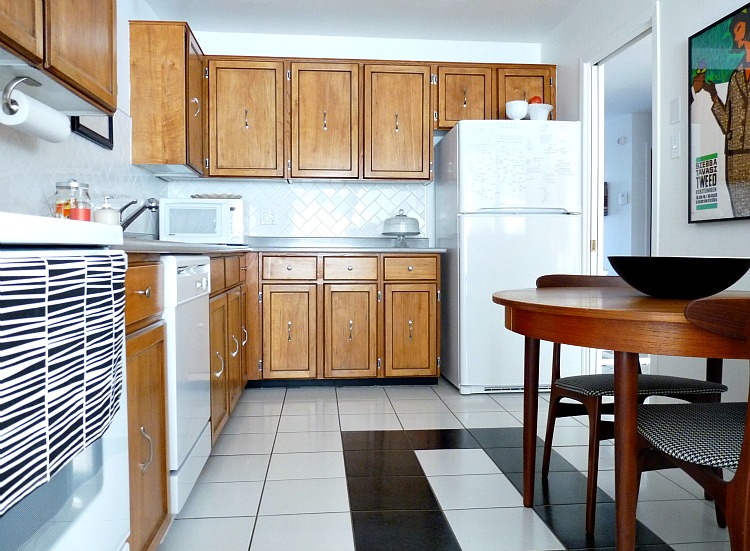
Find the location of `fridge`. fridge is located at coordinates (504, 219).